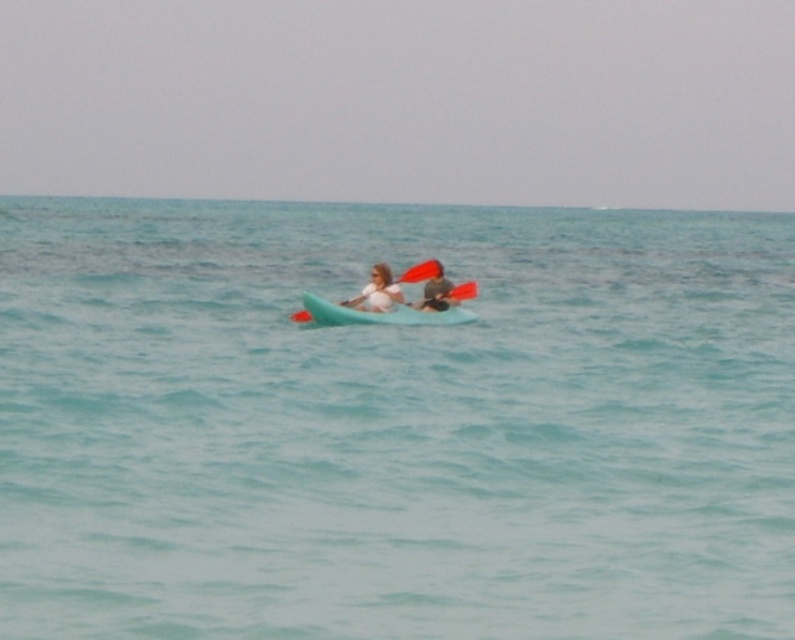
You are a photographer trying to capture the clear blue water at center in the image. The camera is set to focus on the point marked by point [394,422]. Will this point be in focus if you want to capture the clear blue water at center?

Yes, because the clear blue water at center is represented by point [394,422], so focusing on that point will capture the clear blue water at center in focus.

What is the exact coordinate of the teal rubber kayak at center?

The teal rubber kayak at center is located at point (x=375, y=314).

In the scene shown: You are a photographer trying to capture the kayakers from the shore. The teal rubber kayak at center and the rubber paddle at center are both in your view. Which object will appear larger in your photo?

The teal rubber kayak at center will appear larger in the photo because it is closer to the viewer than the rubber paddle at center.